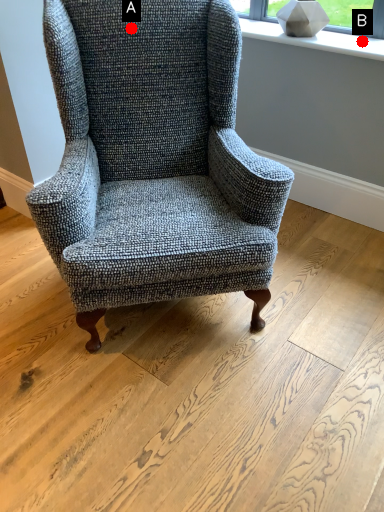
Question: Two points are circled on the image, labeled by A and B beside each circle. Which point is closer to the camera?

Choices:
 (A) A is closer
 (B) B is closer

Answer: (A)